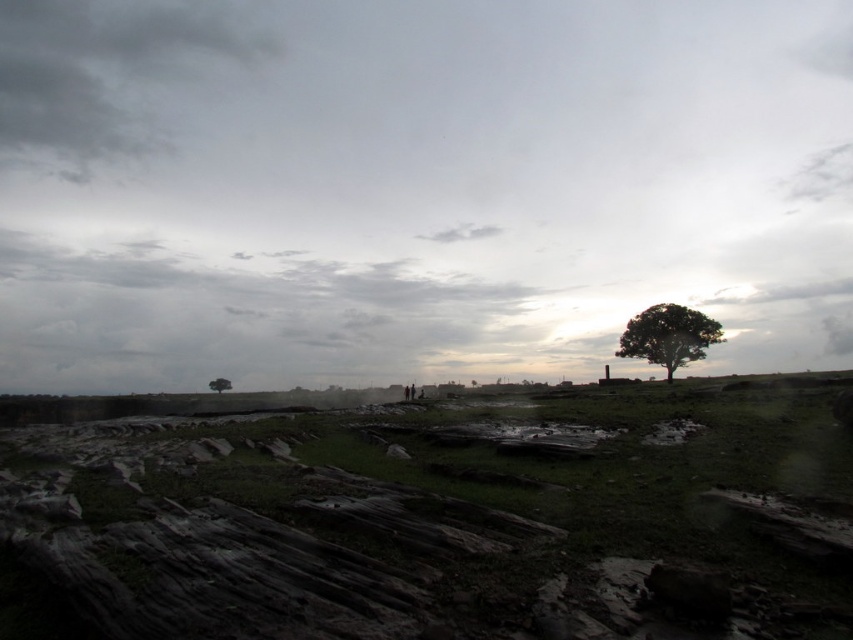
You are a hiker trying to reach the green matte tree at lower center. There is a muddy stone at center in your path. Which object will you encounter first?

The muddy stone at center is closer to the viewer than the green matte tree at lower center, so you will encounter the muddy stone at center first.

You are standing at the point marked as point [106,76] in the image. What is the color of the sky area directly above you?

The point [106,76] is on a dark gray cloud at upper left, so the sky area directly above you would be dark gray.